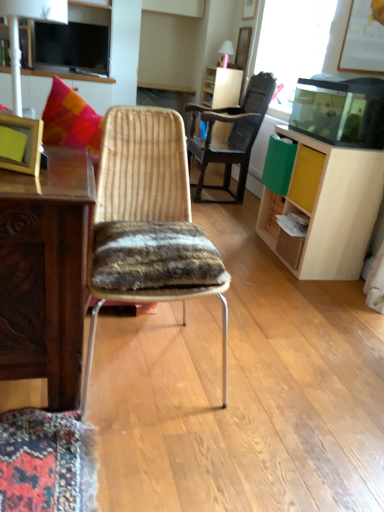
Question: Which direction should I rotate to look at woven wood chair at center, which is counted as the first chair, starting from the bottom, — up or down?

Choices:
 (A) down
 (B) up

Answer: (B)

Question: Is light wood cabinet at right at the right side of light wood drawer at right?

Choices:
 (A) no
 (B) yes

Answer: (B)

Question: Is light wood cabinet at right smaller than light wood drawer at right?

Choices:
 (A) no
 (B) yes

Answer: (A)

Question: Can you confirm if light wood cabinet at right is wider than light wood drawer at right?

Choices:
 (A) no
 (B) yes

Answer: (B)

Question: Is light wood cabinet at right to the left of light wood drawer at right from the viewer's perspective?

Choices:
 (A) yes
 (B) no

Answer: (B)

Question: Is light wood cabinet at right outside of light wood drawer at right?

Choices:
 (A) no
 (B) yes

Answer: (B)

Question: Does light wood cabinet at right have a lesser height compared to light wood drawer at right?

Choices:
 (A) no
 (B) yes

Answer: (A)

Question: Is light wood drawer at right taller than woven wood chair at center, which is the second chair in back-to-front order?

Choices:
 (A) no
 (B) yes

Answer: (A)

Question: Could you tell me if light wood drawer at right is turned towards woven wood chair at center, acting as the 1th chair starting from the front?

Choices:
 (A) yes
 (B) no

Answer: (B)

Question: Can you confirm if light wood drawer at right is wider than woven wood chair at center, which is counted as the first chair, starting from the bottom?

Choices:
 (A) yes
 (B) no

Answer: (B)

Question: Can you confirm if light wood drawer at right is positioned to the right of woven wood chair at center, which appears as the second chair when viewed from the top?

Choices:
 (A) yes
 (B) no

Answer: (A)

Question: Is light wood drawer at right located outside woven wood chair at center, acting as the 1th chair starting from the front?

Choices:
 (A) no
 (B) yes

Answer: (B)

Question: Considering the relative sizes of light wood drawer at right and woven wood chair at center, acting as the 1th chair starting from the front, in the image provided, is light wood drawer at right thinner than woven wood chair at center, acting as the 1th chair starting from the front,?

Choices:
 (A) no
 (B) yes

Answer: (B)

Question: Can you confirm if matte white lamp at upper left is thinner than light wood cabinet at right?

Choices:
 (A) yes
 (B) no

Answer: (A)